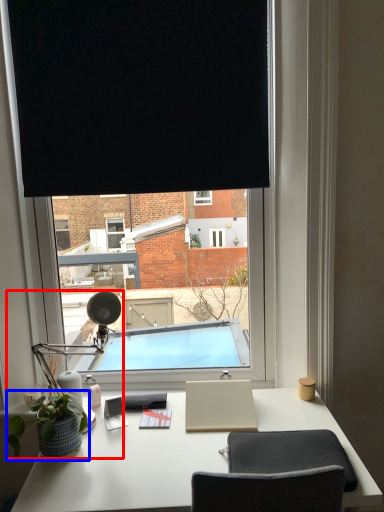
Question: Among these objects, which one is farthest to the camera, table lamp (highlighted by a red box) or houseplant (highlighted by a blue box)?

Choices:
 (A) table lamp
 (B) houseplant

Answer: (A)